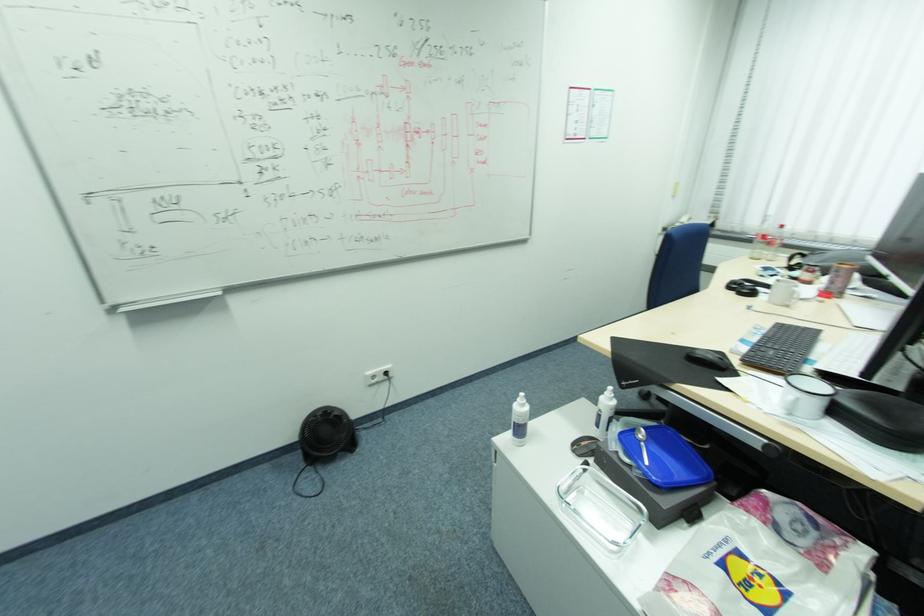
The height and width of the screenshot is (616, 924). What are the coordinates of `small black fan` in the screenshot? It's located at (322, 442).